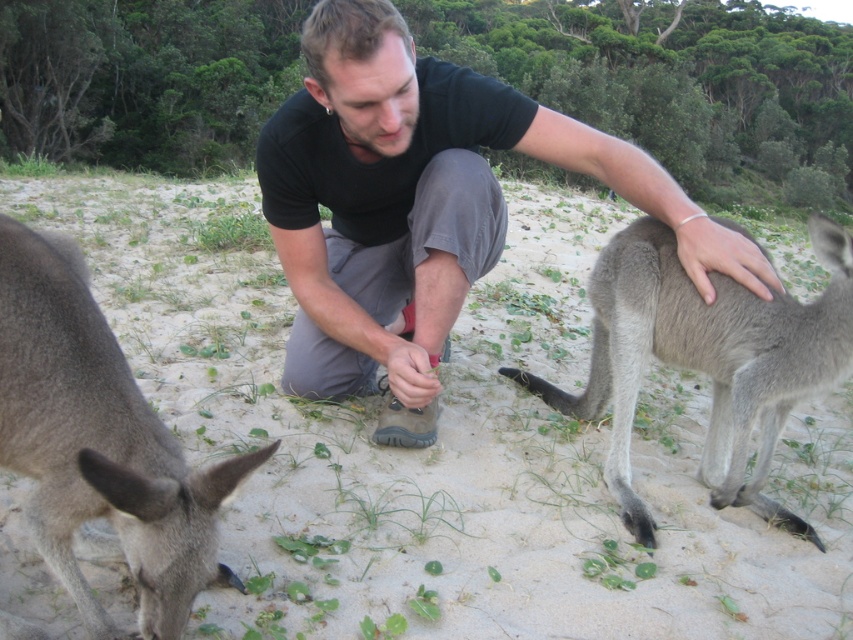
Who is more forward, (90, 497) or (776, 305)?

Positioned in front is point (90, 497).

This screenshot has width=853, height=640. I want to click on gray fur kangaroo at lower left, so click(x=97, y=442).

Is sandy beige sand at center further to the viewer compared to black cotton shirt at center?

That is False.

You are a GUI agent. You are given a task and a screenshot of the screen. Output one action in this format:
    pyautogui.click(x=<x>, y=<y>)
    Task: Click on the sandy beige sand at center
    
    Given the screenshot: What is the action you would take?
    pyautogui.click(x=447, y=445)

The image size is (853, 640). I want to click on sandy beige sand at center, so click(447, 445).

Can you confirm if black cotton shirt at center is thinner than gray fur kangaroo at lower left?

No.

Is point (292, 109) closer to viewer compared to point (7, 346)?

No, (292, 109) is further to viewer.

At what (x,y) coordinates should I click in order to perform the action: click on black cotton shirt at center. Please return your answer as a coordinate pair (x, y). The width and height of the screenshot is (853, 640). Looking at the image, I should click on (422, 204).